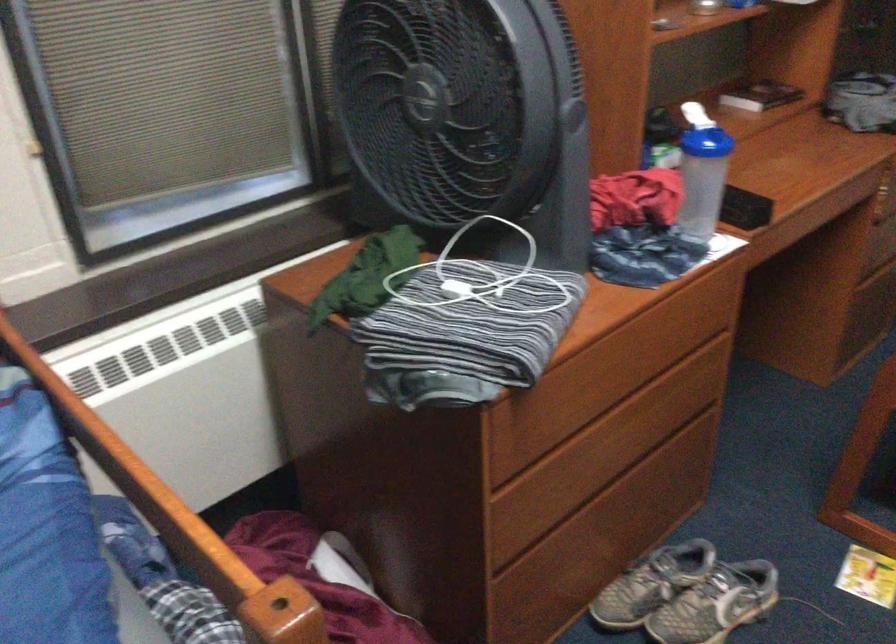
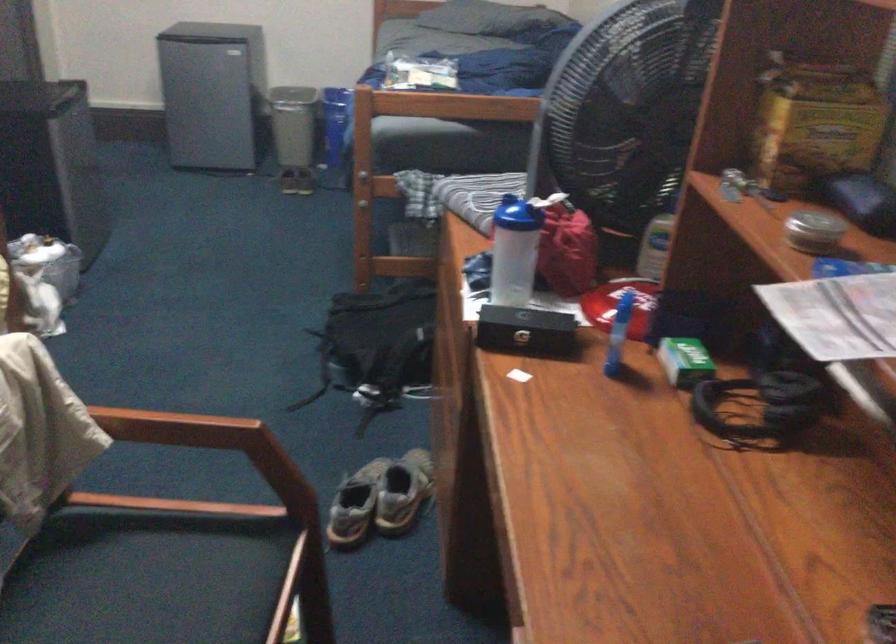
In the second image, find the point that corresponds to (662,149) in the first image.

(685, 361)